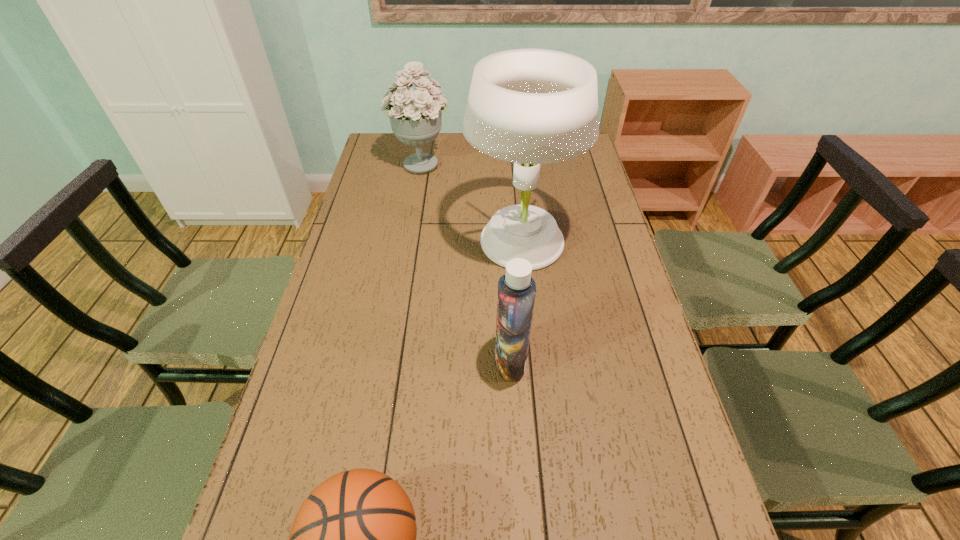
Locate an element on the screen. free space located 0.180m on the front label of the shampoo is located at coordinates (424, 361).

Image resolution: width=960 pixels, height=540 pixels. What are the coordinates of `vacant space located on the front label of the shampoo` in the screenshot? It's located at (412, 361).

Where is `object positioned at the far edge`? The height and width of the screenshot is (540, 960). object positioned at the far edge is located at coordinates (415, 116).

I want to click on object that is at the left edge, so click(415, 116).

Where is `object that is at the right edge`? The image size is (960, 540). object that is at the right edge is located at coordinates (529, 106).

Image resolution: width=960 pixels, height=540 pixels. I want to click on object present at the far left corner, so click(415, 116).

Locate an element on the screen. Image resolution: width=960 pixels, height=540 pixels. free space at the left edge of the desktop is located at coordinates (395, 170).

This screenshot has width=960, height=540. In order to click on vacant space at the right edge of the desktop in this screenshot , I will do `click(618, 278)`.

The width and height of the screenshot is (960, 540). I want to click on blank space at the far left corner of the desktop, so click(x=383, y=138).

The height and width of the screenshot is (540, 960). I want to click on free spot between the tallest object and the farthest object, so click(x=470, y=202).